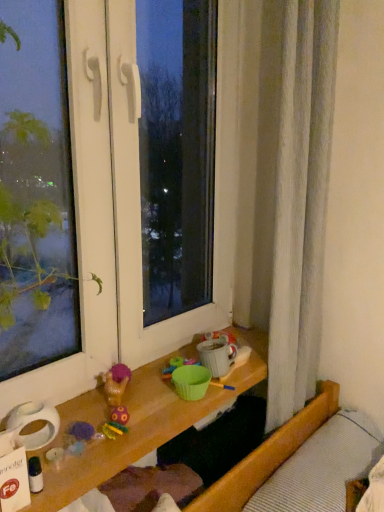
Question: From their relative heights in the image, would you say white textured bed at lower right is taller or shorter than translucent plastic bottle at lower left, marked as the 1th toy in a left-to-right arrangement?

Choices:
 (A) tall
 (B) short

Answer: (A)

Question: Considering the positions of white textured bed at lower right and translucent plastic bottle at lower left, marked as the 1th toy in a left-to-right arrangement, in the image, is white textured bed at lower right bigger or smaller than translucent plastic bottle at lower left, marked as the 1th toy in a left-to-right arrangement,?

Choices:
 (A) big
 (B) small

Answer: (A)

Question: Which of these objects is positioned farthest from the translucent plastic bottle at lower left, which appears as the second toy when viewed from the back?

Choices:
 (A) plush purple toy at lower left, positioned as the second toy in front-to-back order
 (B) white textured bed at lower right
 (C) transparent glass window at center

Answer: (B)

Question: Which object is positioned farthest from the translucent plastic bottle at lower left, the second toy from the right?

Choices:
 (A) plush purple toy at lower left, the 1th toy when ordered from top to bottom
 (B) white textured bed at lower right
 (C) transparent glass window at center

Answer: (B)